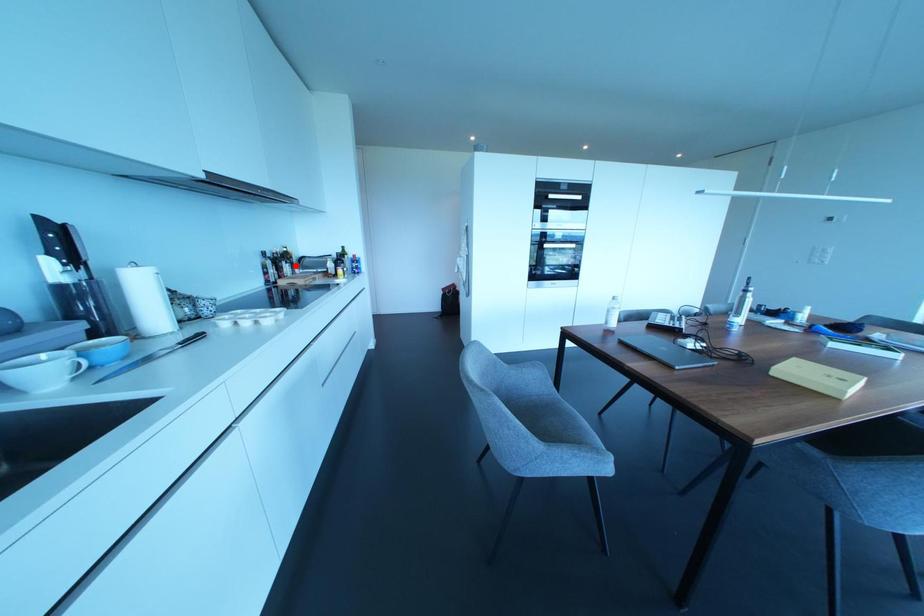
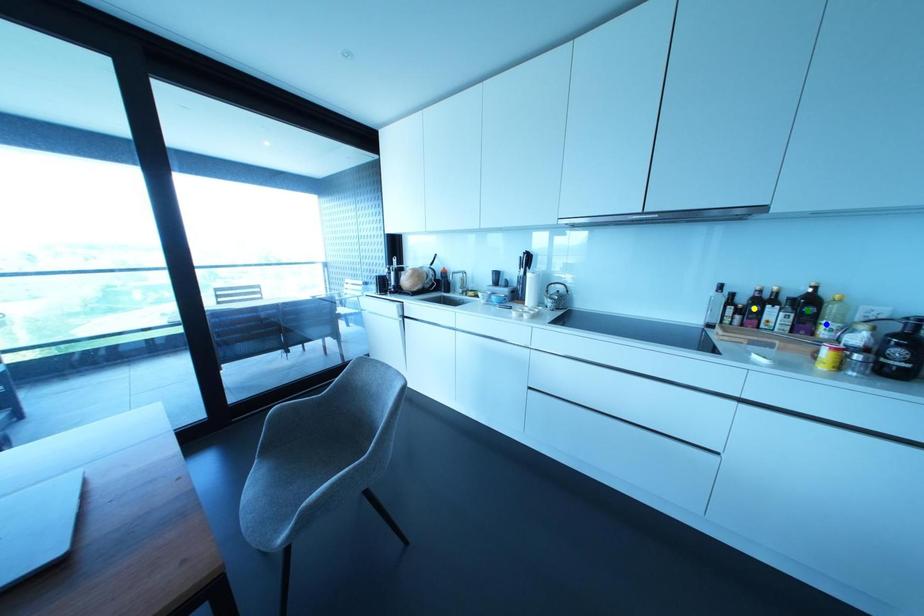
Question: I am providing you with two images of the same scene from different viewpoints. A red point is marked on the first image. You are given multiple points on the second image. Which point in image 2 represents the same 3d spot as the red point in image 1?

Choices:
 (A) green point
 (B) yellow point
 (C) blue point

Answer: (C)